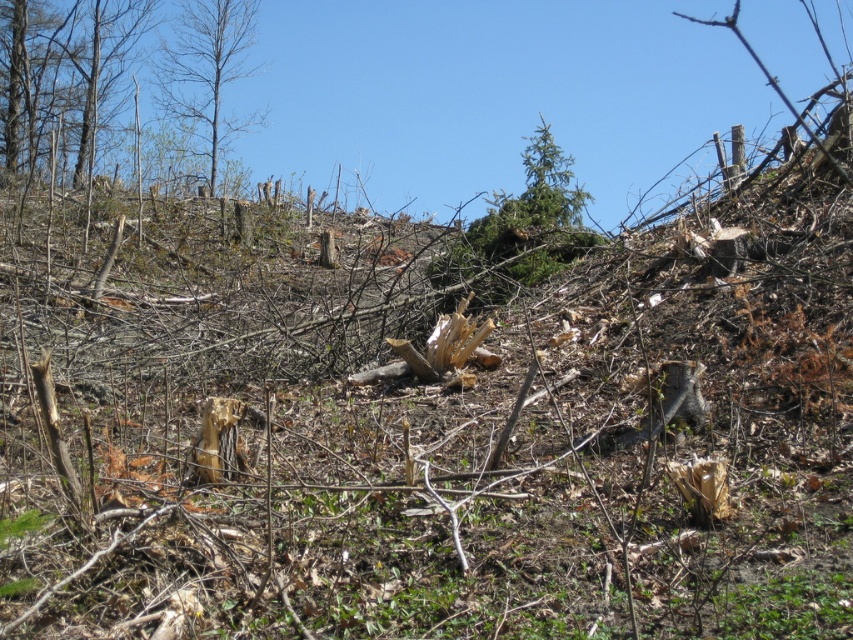
Question: Among these points, which one is farthest from the camera?

Choices:
 (A) (178, 56)
 (B) (511, 276)

Answer: (A)

Question: Can you confirm if green leafy tree at upper center is positioned to the right of bare wood tree at upper left?

Choices:
 (A) no
 (B) yes

Answer: (B)

Question: Estimate the real-world distances between objects in this image. Which object is farther from the smooth bark tree at upper left?

Choices:
 (A) bare wood tree at upper left
 (B) green leafy tree at upper center

Answer: (B)

Question: Estimate the real-world distances between objects in this image. Which object is farther from the bare wood tree at upper left?

Choices:
 (A) smooth bark tree at upper left
 (B) green leafy tree at upper center

Answer: (B)

Question: Where is smooth bark tree at upper left located in relation to bare wood tree at upper left in the image?

Choices:
 (A) right
 (B) left

Answer: (B)

Question: In this image, where is smooth bark tree at upper left located relative to bare wood tree at upper left?

Choices:
 (A) below
 (B) above

Answer: (A)